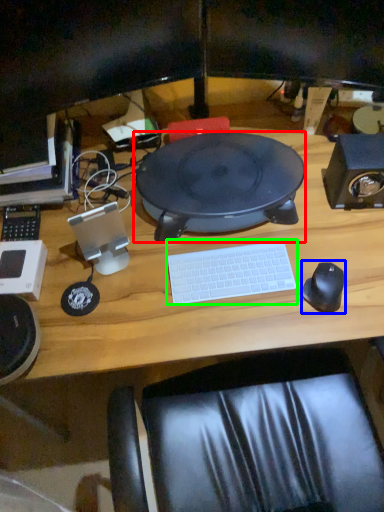
Question: Estimate the real-world distances between objects in this image. Which object is farther from sit (highlighted by a red box), mouse (highlighted by a blue box) or computer keyboard (highlighted by a green box)?

Choices:
 (A) mouse
 (B) computer keyboard

Answer: (A)